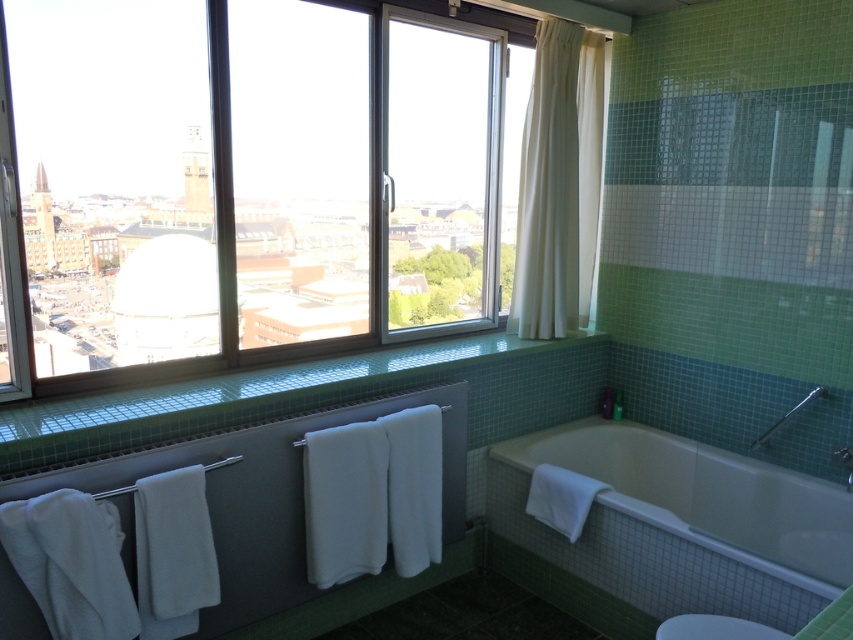
Can you confirm if white glossy bathtub at lower right is positioned to the right of white fabric curtain at upper right?

Correct, you'll find white glossy bathtub at lower right to the right of white fabric curtain at upper right.

Is white glossy bathtub at lower right behind white fabric curtain at upper right?

No, white glossy bathtub at lower right is in front of white fabric curtain at upper right.

Between point (764, 520) and point (606, 93), which one is positioned behind?

Positioned behind is point (606, 93).

The width and height of the screenshot is (853, 640). Identify the location of white glossy bathtub at lower right. (682, 524).

Can you confirm if white fabric curtain at upper center is positioned to the right of satin nickel grab bar at upper right?

In fact, white fabric curtain at upper center is to the left of satin nickel grab bar at upper right.

Locate an element on the screen. white fabric curtain at upper center is located at coordinates 548,189.

Identify the location of white fabric curtain at upper center. (548, 189).

Is point (724, 547) in front of point (547, 118)?

Yes, point (724, 547) is closer to viewer.

Which is above, white glossy bathtub at lower right or white fabric curtain at upper center?

white fabric curtain at upper center is higher up.

The image size is (853, 640). Find the location of `white glossy bathtub at lower right`. white glossy bathtub at lower right is located at coordinates (682, 524).